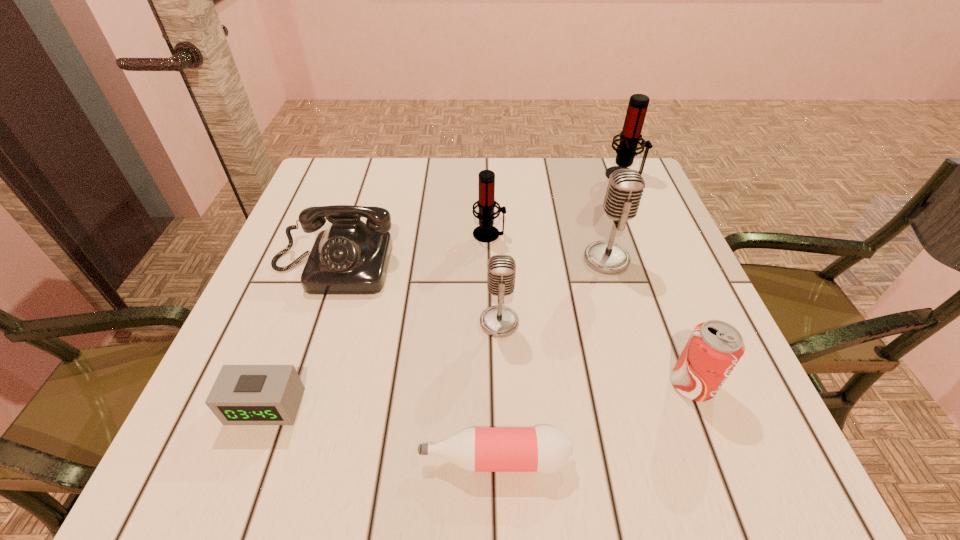
You are a GUI agent. You are given a task and a screenshot of the screen. Output one action in this format:
    pyautogui.click(x=<x>, y=<y>)
    Task: Click on the free region located 0.270m with the cap open on the bottle
    
    Given the screenshot: What is the action you would take?
    click(x=238, y=459)

What are the coordinates of `vacant space located 0.060m with the cap open on the bottle` in the screenshot? It's located at (379, 459).

What are the coordinates of `vacant space located with the cap open on the bottle` in the screenshot? It's located at (346, 459).

Locate an element on the screen. The width and height of the screenshot is (960, 540). object located at the far edge is located at coordinates (630, 137).

You are a GUI agent. You are given a task and a screenshot of the screen. Output one action in this format:
    pyautogui.click(x=<x>, y=<y>)
    Task: Click on the alarm clock situated at the near edge
    This screenshot has height=540, width=960.
    Given the screenshot: What is the action you would take?
    pyautogui.click(x=242, y=394)

I want to click on bottle located at the near edge, so click(x=545, y=449).

The height and width of the screenshot is (540, 960). Identify the location of telephone located in the left edge section of the desktop. [x=350, y=258].

Find the location of a particular element. alarm clock situated at the left edge is located at coordinates (242, 394).

Where is `soda can that is at the right edge`? Image resolution: width=960 pixels, height=540 pixels. soda can that is at the right edge is located at coordinates (714, 348).

I want to click on object that is at the near left corner, so click(x=242, y=394).